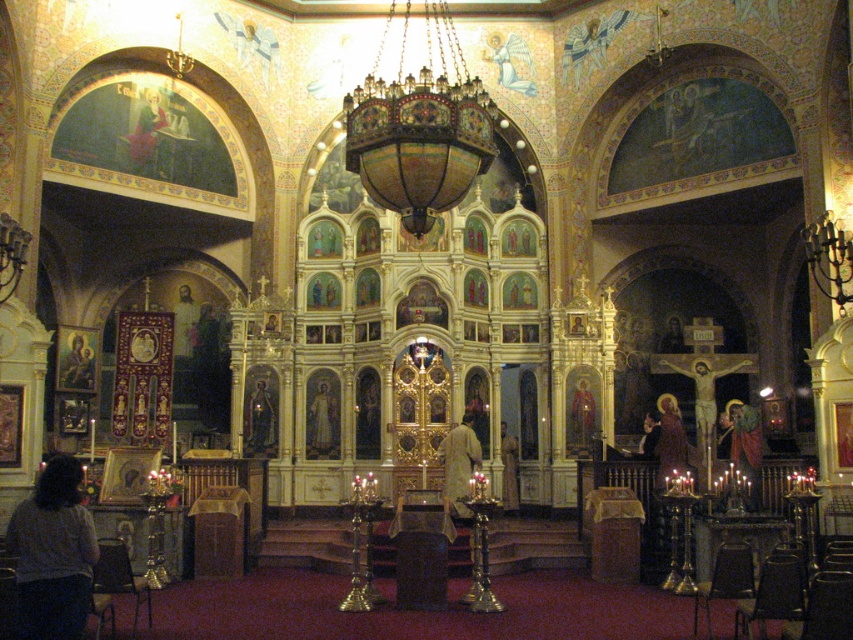
You are an architect designing a new church and want to place a new decorative element on the wall. The element must be placed exactly at the same coordinates as the gold leaf icon at center. What are the coordinates where you should place the new element?

The coordinates for the gold leaf icon at center are 0.653 in the x direction and 0.306 in the y direction, so you should place the new decorative element at those exact coordinates.

You are an interior designer planning to install a new lighting fixture in the church. You have two options based on the existing items. The first option is a pendant light that needs to be as tall as the light beige fabric at center. The second option is a wall sconce that should be as tall as the matte gold icon at upper left. Which option will result in a taller fixture?

The light beige fabric at center is taller than the matte gold icon at upper left, so the pendant light based on the light beige fabric at center will be the taller option.